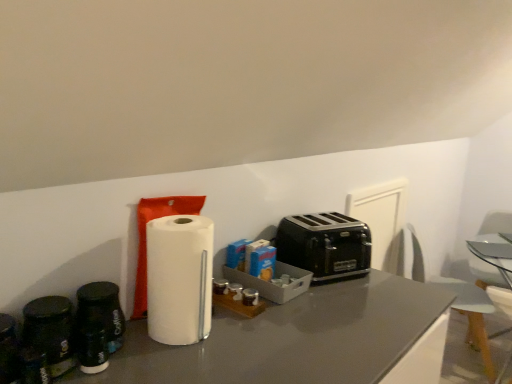
Question: From a real-world perspective, is clear glass table at center located higher than white plastic swivel chair at right, which is counted as the 1th swivel chair, starting from the left?

Choices:
 (A) yes
 (B) no

Answer: (A)

Question: Does clear glass table at center have a lesser height compared to white plastic swivel chair at right, which is counted as the 1th swivel chair, starting from the left?

Choices:
 (A) no
 (B) yes

Answer: (B)

Question: From the image's perspective, is clear glass table at center above white plastic swivel chair at right, which is counted as the 1th swivel chair, starting from the left?

Choices:
 (A) no
 (B) yes

Answer: (B)

Question: From a real-world perspective, is clear glass table at center physically below white plastic swivel chair at right, which is counted as the 1th swivel chair, starting from the left?

Choices:
 (A) yes
 (B) no

Answer: (B)

Question: Is clear glass table at center smaller than white plastic swivel chair at right, the 2th swivel chair positioned from the right?

Choices:
 (A) no
 (B) yes

Answer: (B)

Question: From the image's perspective, is white plastic swivel chair at right, acting as the 2th swivel chair starting from the left, located above or below black metallic toaster at center?

Choices:
 (A) below
 (B) above

Answer: (A)

Question: Based on their sizes in the image, would you say white plastic swivel chair at right, which appears as the first swivel chair when viewed from the right, is bigger or smaller than black metallic toaster at center?

Choices:
 (A) small
 (B) big

Answer: (B)

Question: Is point (509, 231) positioned closer to the camera than point (290, 258)?

Choices:
 (A) closer
 (B) farther

Answer: (B)

Question: Would you say white plastic swivel chair at right, acting as the 2th swivel chair starting from the left, is to the left or to the right of black metallic toaster at center in the picture?

Choices:
 (A) right
 (B) left

Answer: (A)

Question: Is black matte coffee canister at left in front of or behind black metallic toaster at center in the image?

Choices:
 (A) behind
 (B) front

Answer: (B)

Question: From a real-world perspective, is black matte coffee canister at left physically located above or below black metallic toaster at center?

Choices:
 (A) above
 (B) below

Answer: (B)

Question: Is black matte coffee canister at left wider or thinner than black metallic toaster at center?

Choices:
 (A) thin
 (B) wide

Answer: (A)

Question: In terms of height, does black matte coffee canister at left look taller or shorter compared to black metallic toaster at center?

Choices:
 (A) short
 (B) tall

Answer: (A)

Question: In terms of width, does clear glass table at center look wider or thinner when compared to white matte paper towel at center?

Choices:
 (A) wide
 (B) thin

Answer: (A)

Question: Considering the positions of clear glass table at center and white matte paper towel at center in the image, is clear glass table at center taller or shorter than white matte paper towel at center?

Choices:
 (A) tall
 (B) short

Answer: (B)